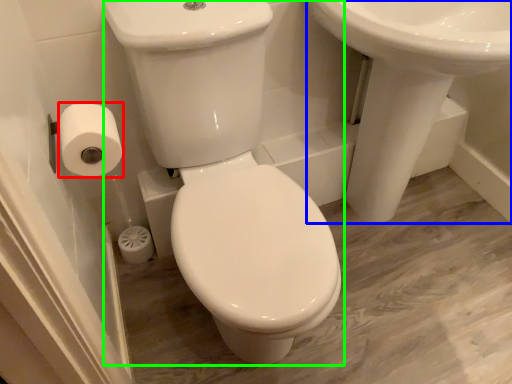
Question: Which object is the farthest from toilet paper (highlighted by a red box)? Choose among these: sink (highlighted by a blue box) or porcelain (highlighted by a green box).

Choices:
 (A) sink
 (B) porcelain

Answer: (A)